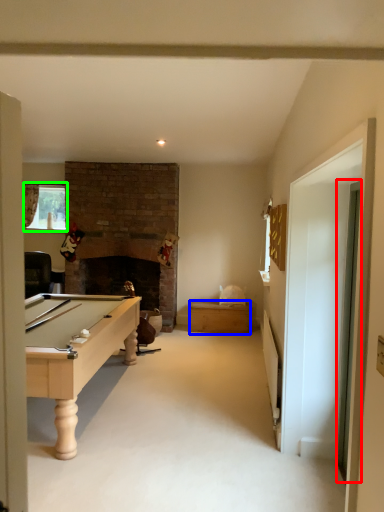
Question: Based on their relative distances, which object is farther from glass door (highlighted by a red box)? Choose from drawer (highlighted by a blue box) and window (highlighted by a green box).

Choices:
 (A) drawer
 (B) window

Answer: (B)